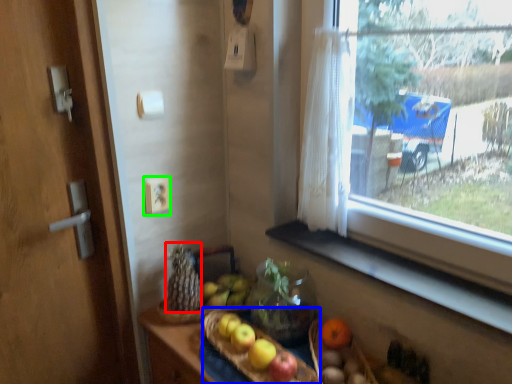
Question: Estimate the real-world distances between objects in this image. Which object is farther from food (highlighted by a red box), basket (highlighted by a blue box) or electric outlet (highlighted by a green box)?

Choices:
 (A) basket
 (B) electric outlet

Answer: (B)